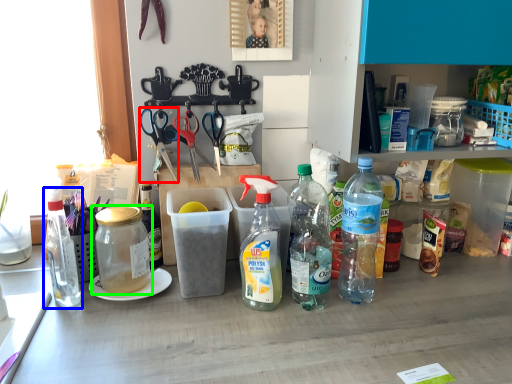
Question: Considering the real-world distances, which object is farthest from scissors (highlighted by a red box)? bottle (highlighted by a blue box) or bottle (highlighted by a green box)?

Choices:
 (A) bottle
 (B) bottle

Answer: (A)